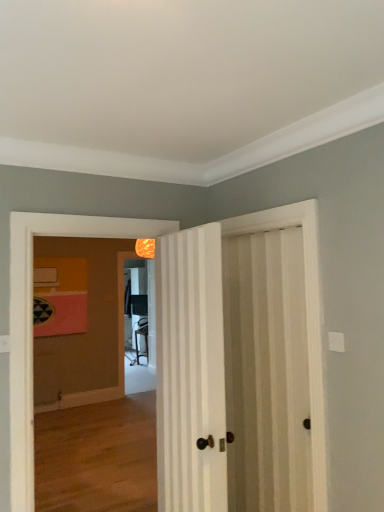
Measure the distance between white striped door at center, the second door in the right-to-left sequence, and camera.

white striped door at center, the second door in the right-to-left sequence, and camera are 1.85 meters apart from each other.

Measure the distance between point [154,329] and camera.

Point [154,329] is 2.81 meters from camera.

What do you see at coordinates (125, 343) in the screenshot? I see `matte black screen door at center` at bounding box center [125, 343].

The height and width of the screenshot is (512, 384). What do you see at coordinates (91, 399) in the screenshot?
I see `wooden floor at center` at bounding box center [91, 399].

This screenshot has width=384, height=512. I want to click on white striped door at center, the second door in the right-to-left sequence, so click(x=190, y=371).

From the picture: Which is farther from the camera, (148, 310) or (196, 276)?

Point (148, 310)

Looking at this image, from a real-world perspective, is matte black screen door at center under white striped door at center, the second door in the right-to-left sequence?

Yes.

From the image's perspective, is matte black screen door at center below white striped door at center, the second door in the right-to-left sequence?

Indeed, from the image's perspective, matte black screen door at center is shown beneath white striped door at center, the second door in the right-to-left sequence.

How many degrees apart are the facing directions of matte black screen door at center and white striped door at center, the second door in the right-to-left sequence?

There is a 98.3-degree angle between the facing directions of matte black screen door at center and white striped door at center, the second door in the right-to-left sequence.

Does point (149, 330) lie in front of point (101, 499)?

No, it is not.

Does matte black screen door at center come behind wooden floor at center?

That is True.

Is matte black screen door at center located outside wooden floor at center?

Yes, matte black screen door at center is outside of wooden floor at center.

From a real-world perspective, which object stands above the other?

wooden floor at center.

From the image's perspective, is white striped door at center, marked as the 1th door in a left-to-right arrangement, positioned above or below matte black screen door at center?

Clearly, from the image's perspective, white striped door at center, marked as the 1th door in a left-to-right arrangement, is above matte black screen door at center.

Does point (177, 308) come in front of point (154, 329)?

Yes, it is.

Who is shorter, white striped door at center, the second door in the right-to-left sequence, or matte black screen door at center?

white striped door at center, the second door in the right-to-left sequence.

Is white striped door at center, the second door in the right-to-left sequence, thinner than matte black screen door at center?

No, white striped door at center, the second door in the right-to-left sequence, is not thinner than matte black screen door at center.

Would you say matte black screen door at center is a long distance from white striped door at right, arranged as the first door when viewed from the right?

Yes, matte black screen door at center and white striped door at right, arranged as the first door when viewed from the right, are located far from each other.

Considering the positions of point (134, 292) and point (280, 397), is point (134, 292) closer or farther from the camera than point (280, 397)?

Point (134, 292) appears to be farther away from the viewer than point (280, 397).

Between matte black screen door at center and white striped door at right, arranged as the first door when viewed from the right, which one is positioned in front?

Positioned in front is white striped door at right, arranged as the first door when viewed from the right.

From the image's perspective, is matte black screen door at center on top of white striped door at right, arranged as the first door when viewed from the right?

No.

From a real-world perspective, does white striped door at center, marked as the 1th door in a left-to-right arrangement, stand above white striped door at right, acting as the second door starting from the left?

Yes.

Is white striped door at center, marked as the 1th door in a left-to-right arrangement, next to white striped door at right, acting as the second door starting from the left?

white striped door at center, marked as the 1th door in a left-to-right arrangement, is not next to white striped door at right, acting as the second door starting from the left, and they're not touching.

Does white striped door at center, the second door in the right-to-left sequence, have a greater height compared to white striped door at right, acting as the second door starting from the left?

Incorrect, the height of white striped door at center, the second door in the right-to-left sequence, is not larger of that of white striped door at right, acting as the second door starting from the left.

Who is more distant, wooden floor at center or white striped door at center, marked as the 1th door in a left-to-right arrangement?

Positioned behind is wooden floor at center.

Is there a large distance between wooden floor at center and white striped door at center, the second door in the right-to-left sequence?

Yes.

How different are the orientations of wooden floor at center and white striped door at center, the second door in the right-to-left sequence, in degrees?

The angle between the facing direction of wooden floor at center and the facing direction of white striped door at center, the second door in the right-to-left sequence, is 99.2 degrees.

Does wooden floor at center appear on the left side of white striped door at center, the second door in the right-to-left sequence?

Indeed, wooden floor at center is positioned on the left side of white striped door at center, the second door in the right-to-left sequence.

Consider the image. Considering the positions of objects white striped door at center, the second door in the right-to-left sequence, and wooden floor at center in the image provided, who is behind, white striped door at center, the second door in the right-to-left sequence, or wooden floor at center?

wooden floor at center is behind.

Which point is more forward, (210,470) or (108,436)?

Positioned in front is point (210,470).

Considering the relative sizes of white striped door at center, the second door in the right-to-left sequence, and wooden floor at center in the image provided, is white striped door at center, the second door in the right-to-left sequence, bigger than wooden floor at center?

Correct, white striped door at center, the second door in the right-to-left sequence, is larger in size than wooden floor at center.

Can you tell me how much white striped door at center, marked as the 1th door in a left-to-right arrangement, and wooden floor at center differ in facing direction?

They differ by 99.2 degrees in their facing directions.

Find the location of a particular element. This screenshot has height=512, width=384. the 2nd door in front when counting from the matte black screen door at center is located at coordinates (190, 371).

At what (x,y) coordinates should I click in order to perform the action: click on corridor that appears above the matte black screen door at center (from the image's perspective). Please return your answer as a coordinate pair (x, y). Looking at the image, I should click on (91, 399).

Consider the image. Estimate the real-world distances between objects in this image. Which object is closer to matte black screen door at center, white striped door at right, acting as the second door starting from the left, or wooden floor at center?

wooden floor at center is closer to matte black screen door at center.

When comparing their distances from white striped door at center, marked as the 1th door in a left-to-right arrangement, does matte black screen door at center or white striped door at right, acting as the second door starting from the left, seem further?

Among the two, matte black screen door at center is located further to white striped door at center, marked as the 1th door in a left-to-right arrangement.

Estimate the real-world distances between objects in this image. Which object is further from wooden floor at center, matte black screen door at center or white striped door at right, arranged as the first door when viewed from the right?

Among the two, white striped door at right, arranged as the first door when viewed from the right, is located further to wooden floor at center.

From the image, which object appears to be nearer to wooden floor at center, white striped door at center, marked as the 1th door in a left-to-right arrangement, or white striped door at right, acting as the second door starting from the left?

white striped door at center, marked as the 1th door in a left-to-right arrangement.

Which object lies nearer to the anchor point matte black screen door at center, wooden floor at center or white striped door at right, acting as the second door starting from the left?

The object closer to matte black screen door at center is wooden floor at center.

From the image, which object appears to be farther from matte black screen door at center, wooden floor at center or white striped door at center, marked as the 1th door in a left-to-right arrangement?

white striped door at center, marked as the 1th door in a left-to-right arrangement.

Based on their spatial positions, is white striped door at right, arranged as the first door when viewed from the right, or white striped door at center, marked as the 1th door in a left-to-right arrangement, closer to matte black screen door at center?

Among the two, white striped door at right, arranged as the first door when viewed from the right, is located nearer to matte black screen door at center.

Based on their spatial positions, is matte black screen door at center or wooden floor at center closer to white striped door at center, marked as the 1th door in a left-to-right arrangement?

Among the two, wooden floor at center is located nearer to white striped door at center, marked as the 1th door in a left-to-right arrangement.

Locate an element on the screen. The image size is (384, 512). corridor positioned between white striped door at right, acting as the second door starting from the left, and matte black screen door at center from near to far is located at coordinates (91, 399).

At what (x,y) coordinates should I click in order to perform the action: click on corridor between white striped door at center, the second door in the right-to-left sequence, and matte black screen door at center from front to back. Please return your answer as a coordinate pair (x, y). Looking at the image, I should click on (91, 399).

Find the location of a particular element. The width and height of the screenshot is (384, 512). door between white striped door at center, the second door in the right-to-left sequence, and matte black screen door at center in the front-back direction is located at coordinates pos(267,372).

Identify the location of door between wooden floor at center and white striped door at right, acting as the second door starting from the left, in the horizontal direction. Image resolution: width=384 pixels, height=512 pixels. (190, 371).